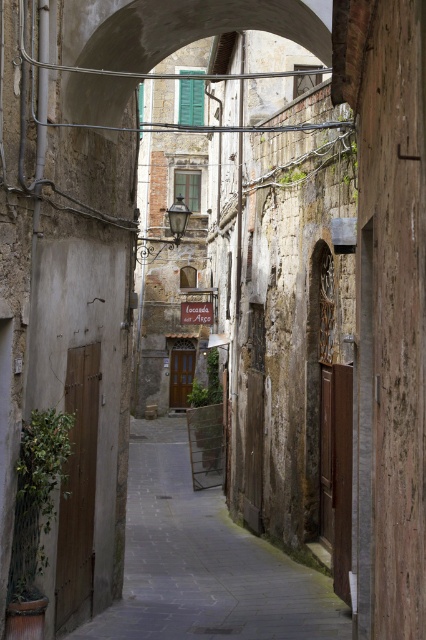
Does smooth stone path at center appear over smooth stone arch at center?

No.

Can you confirm if smooth stone path at center is thinner than smooth stone arch at center?

No, smooth stone path at center is not thinner than smooth stone arch at center.

The height and width of the screenshot is (640, 426). Find the location of `smooth stone path at center`. smooth stone path at center is located at coordinates (204, 561).